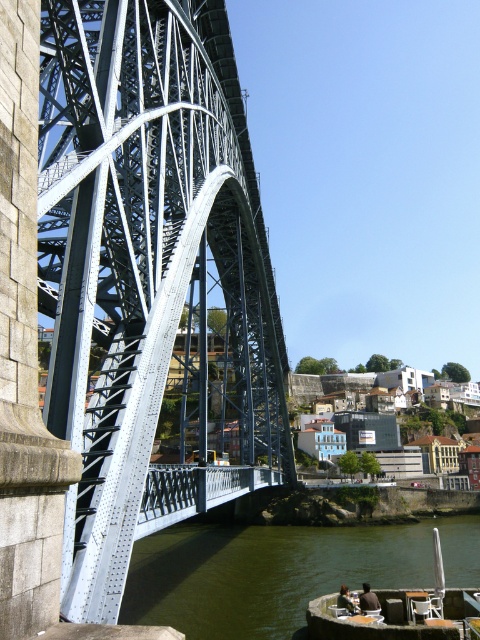
Can you confirm if metallic steel arch bridge at left is thinner than wooden boat at lower right?

In fact, metallic steel arch bridge at left might be wider than wooden boat at lower right.

Which of these two, metallic steel arch bridge at left or wooden boat at lower right, stands shorter?

Standing shorter between the two is wooden boat at lower right.

Describe the element at coordinates (151, 278) in the screenshot. I see `metallic steel arch bridge at left` at that location.

Where is `metallic steel arch bridge at left`? The image size is (480, 640). metallic steel arch bridge at left is located at coordinates [x=151, y=278].

Is point (110, 225) less distant than point (325, 572)?

Yes, point (110, 225) is closer to viewer.

Does point (170, 515) come in front of point (383, 554)?

Yes, it is.

Where is `metallic steel arch bridge at left`? The height and width of the screenshot is (640, 480). metallic steel arch bridge at left is located at coordinates (151, 278).

Between greenish water at lower center and wooden boat at lower right, which one is positioned higher?

Positioned higher is wooden boat at lower right.

Is greenish water at lower center wider than wooden boat at lower right?

Indeed, greenish water at lower center has a greater width compared to wooden boat at lower right.

You are a GUI agent. You are given a task and a screenshot of the screen. Output one action in this format:
    pyautogui.click(x=<x>, y=<y>)
    Task: Click on the greenish water at lower center
    
    Given the screenshot: What is the action you would take?
    pyautogui.click(x=280, y=572)